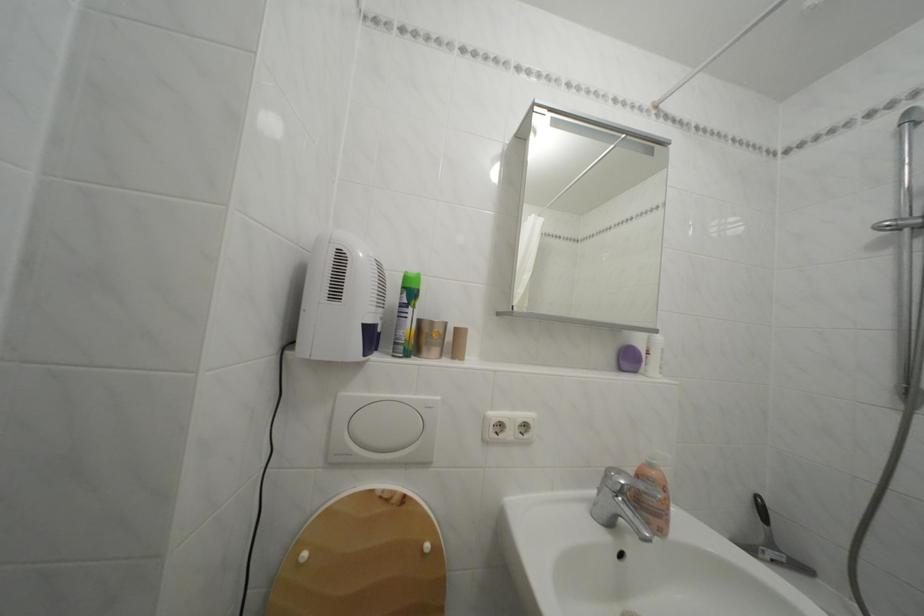
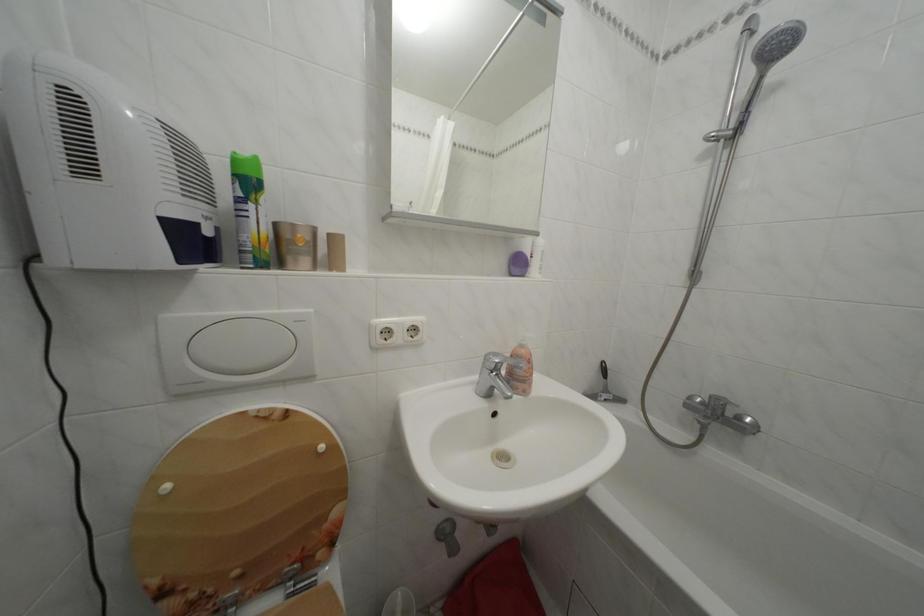
Find the pixel in the second image that matches [313,561] in the first image.

(176, 493)